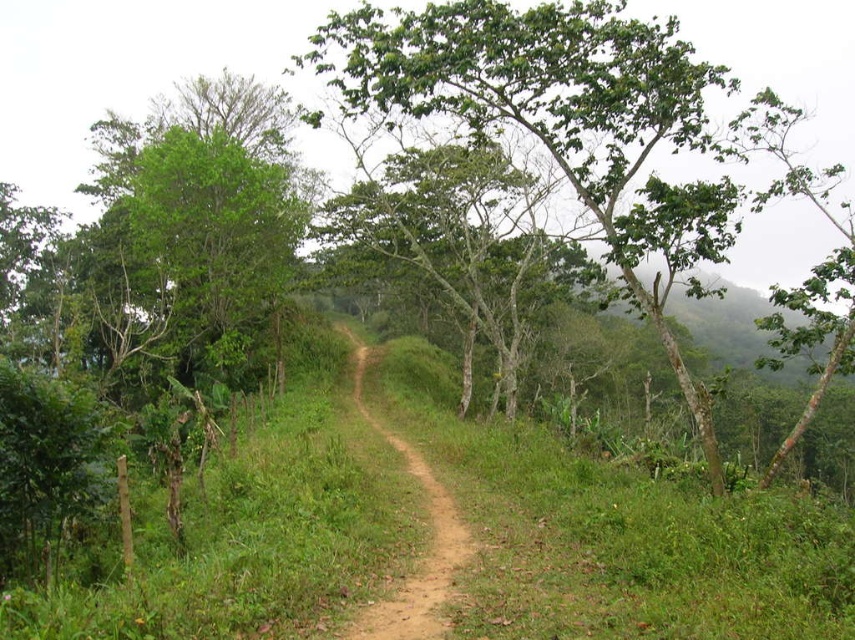
This screenshot has height=640, width=855. What do you see at coordinates (606, 145) in the screenshot?
I see `green leafy tree at center` at bounding box center [606, 145].

Which of these two, green leafy tree at center or brown dirt track at center, stands shorter?

With less height is brown dirt track at center.

Describe the element at coordinates (606, 145) in the screenshot. This screenshot has width=855, height=640. I see `green leafy tree at center` at that location.

Find the location of a particular element. This screenshot has width=855, height=640. green leafy tree at center is located at coordinates (606, 145).